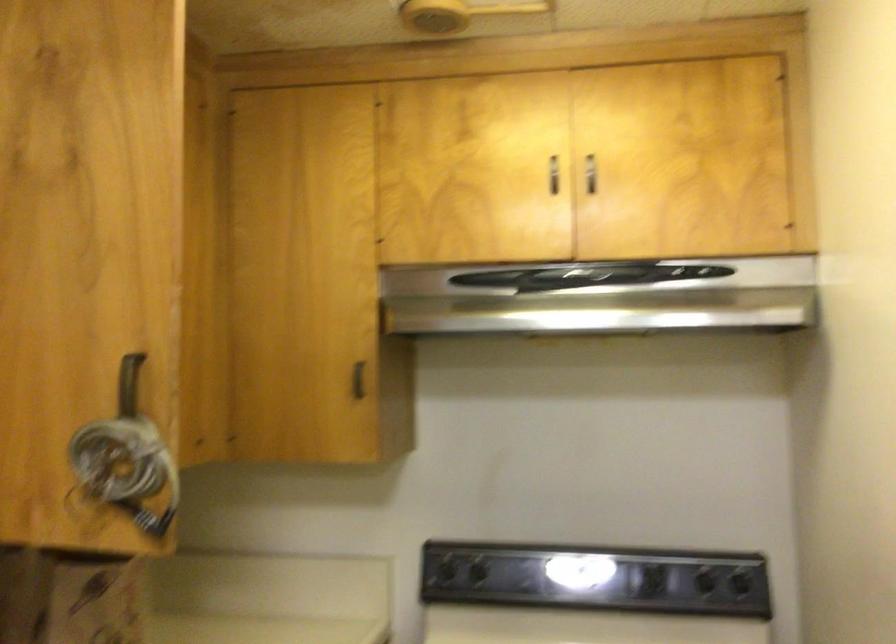
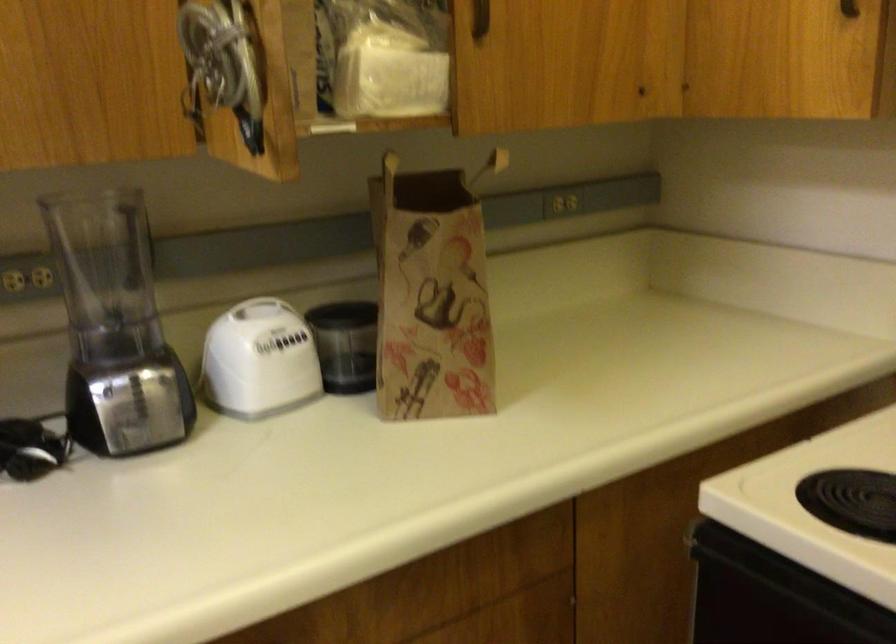
First-person continuous shooting, in which direction is the camera rotating?

The rotation direction of the camera is left-down.